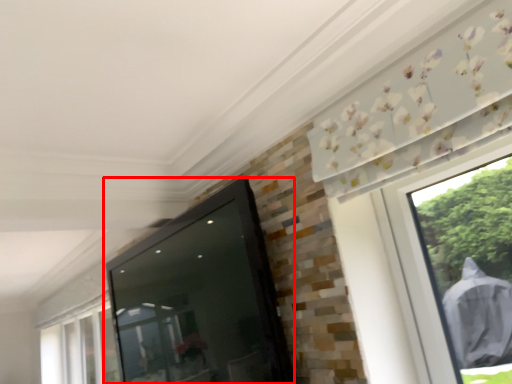
Question: Observing the image, what is the correct spatial positioning of screen door (annotated by the red box) in reference to window?

Choices:
 (A) right
 (B) left

Answer: (A)